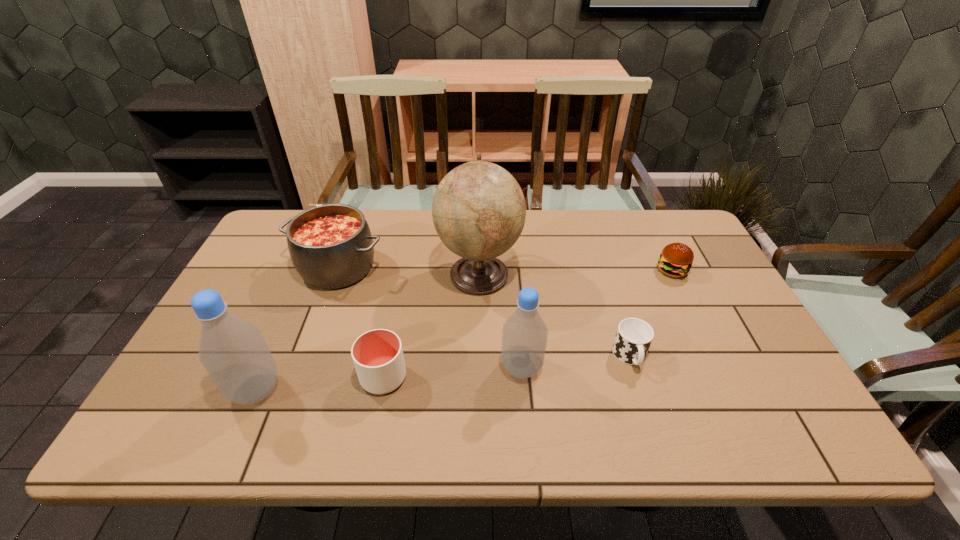
Where is `the sixth shortest object`? the sixth shortest object is located at coordinates (233, 351).

What are the coordinates of `the taller bottle` in the screenshot? It's located at point(233,351).

What are the coordinates of `the right bottle` in the screenshot? It's located at (524, 336).

The image size is (960, 540). Identify the location of the shorter bottle. (524, 336).

You are a GUI agent. You are given a task and a screenshot of the screen. Output one action in this format:
    pyautogui.click(x=<x>, y=<y>)
    Task: Click on the hamburger
    The width and height of the screenshot is (960, 540).
    Given the screenshot: What is the action you would take?
    pyautogui.click(x=676, y=259)

The image size is (960, 540). What are the coordinates of `the fourth tallest object` in the screenshot? It's located at (331, 246).

Identify the location of the tallest object. Image resolution: width=960 pixels, height=540 pixels. (478, 210).

Find the location of a particular element. the shorter cup is located at coordinates (634, 336).

Where is `the right cup`? This screenshot has width=960, height=540. the right cup is located at coordinates (634, 336).

You are a GUI agent. You are given a task and a screenshot of the screen. Output one action in this format:
    pyautogui.click(x=<x>, y=<y>)
    Task: Click on the taller cup
    
    Given the screenshot: What is the action you would take?
    pyautogui.click(x=378, y=358)